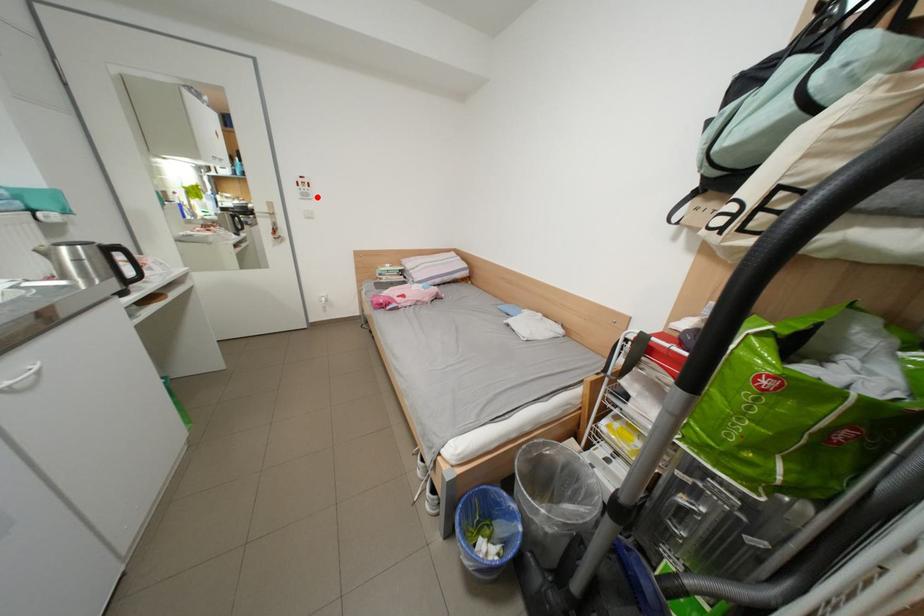
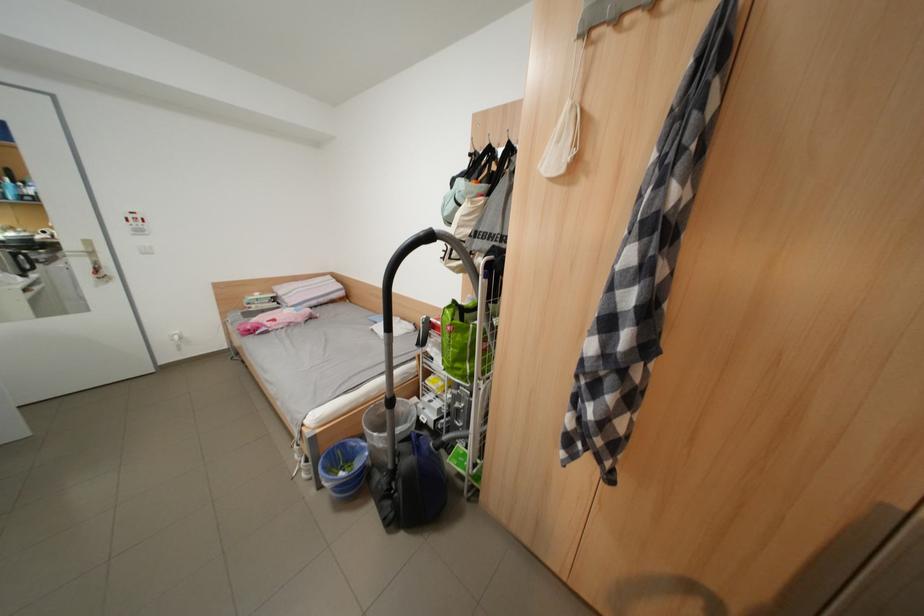
The point at the highlighted location is marked in the first image. Where is the corresponding point in the second image?

(152, 233)